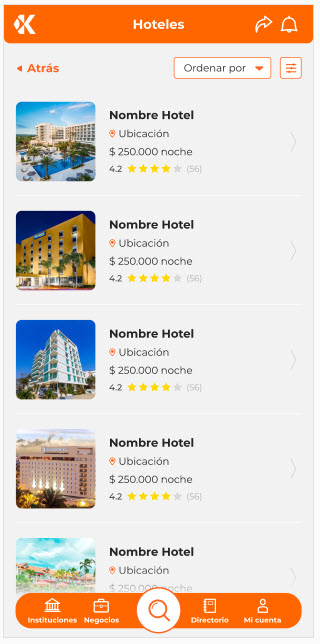
Locate an element on the screen. hotel is located at coordinates (69, 466).